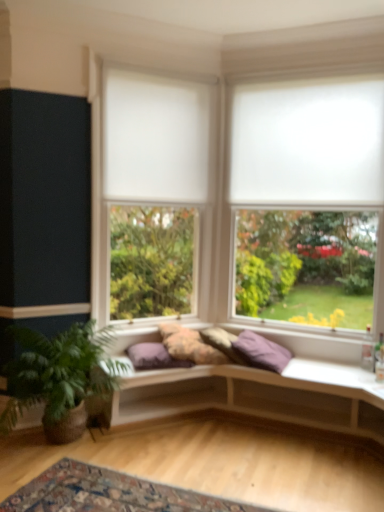
Question: Can you confirm if purple fabric pillow at center, which appears as the second pillow when viewed from the right, is smaller than green leafy plant at lower left?

Choices:
 (A) no
 (B) yes

Answer: (B)

Question: Is purple fabric pillow at center, which appears as the second pillow when viewed from the right, facing towards green leafy plant at lower left?

Choices:
 (A) no
 (B) yes

Answer: (A)

Question: Is purple fabric pillow at center, which is counted as the 2th pillow, starting from the left, positioned with its back to green leafy plant at lower left?

Choices:
 (A) no
 (B) yes

Answer: (A)

Question: Does purple fabric pillow at center, which is counted as the 2th pillow, starting from the left, have a lesser height compared to green leafy plant at lower left?

Choices:
 (A) no
 (B) yes

Answer: (B)

Question: From the image's perspective, is purple fabric pillow at center, which is counted as the 2th pillow, starting from the left, above green leafy plant at lower left?

Choices:
 (A) yes
 (B) no

Answer: (A)

Question: In terms of width, does purple fabric pillow at center, which is counted as the 2th pillow, starting from the left, look wider or thinner when compared to purple fabric pillow at center, which is the first pillow from right to left?

Choices:
 (A) wide
 (B) thin

Answer: (B)

Question: From the image's perspective, relative to purple fabric pillow at center, arranged as the 3th pillow when viewed from the left, is purple fabric pillow at center, which is counted as the 2th pillow, starting from the left, above or below?

Choices:
 (A) above
 (B) below

Answer: (A)

Question: Is purple fabric pillow at center, which appears as the second pillow when viewed from the right, inside or outside of purple fabric pillow at center, which is the first pillow from right to left?

Choices:
 (A) inside
 (B) outside

Answer: (A)

Question: Is purple fabric pillow at center, which is counted as the 2th pillow, starting from the left, in front of or behind purple fabric pillow at center, which is the first pillow from right to left, in the image?

Choices:
 (A) front
 (B) behind

Answer: (B)

Question: In terms of size, does fluffy fabric pillow at center, which is the third pillow in right-to-left order, appear bigger or smaller than white matte window at center, which is the 2th window in right-to-left order?

Choices:
 (A) big
 (B) small

Answer: (B)

Question: Considering the positions of fluffy fabric pillow at center, which is the third pillow in right-to-left order, and white matte window at center, which is the 2th window in right-to-left order, in the image, is fluffy fabric pillow at center, which is the third pillow in right-to-left order, taller or shorter than white matte window at center, which is the 2th window in right-to-left order,?

Choices:
 (A) tall
 (B) short

Answer: (B)

Question: Looking at their shapes, would you say fluffy fabric pillow at center, marked as the first pillow in a left-to-right arrangement, is wider or thinner than white matte window at center, which is the 2th window in right-to-left order?

Choices:
 (A) thin
 (B) wide

Answer: (B)

Question: Is point (210, 356) closer or farther from the camera than point (155, 169)?

Choices:
 (A) farther
 (B) closer

Answer: (B)

Question: In terms of height, does fluffy fabric pillow at center, which is the third pillow in right-to-left order, look taller or shorter compared to purple fabric pillow at center, arranged as the 3th pillow when viewed from the left?

Choices:
 (A) tall
 (B) short

Answer: (A)

Question: Looking at the image, does fluffy fabric pillow at center, marked as the first pillow in a left-to-right arrangement, seem bigger or smaller compared to purple fabric pillow at center, which is the first pillow from right to left?

Choices:
 (A) small
 (B) big

Answer: (B)